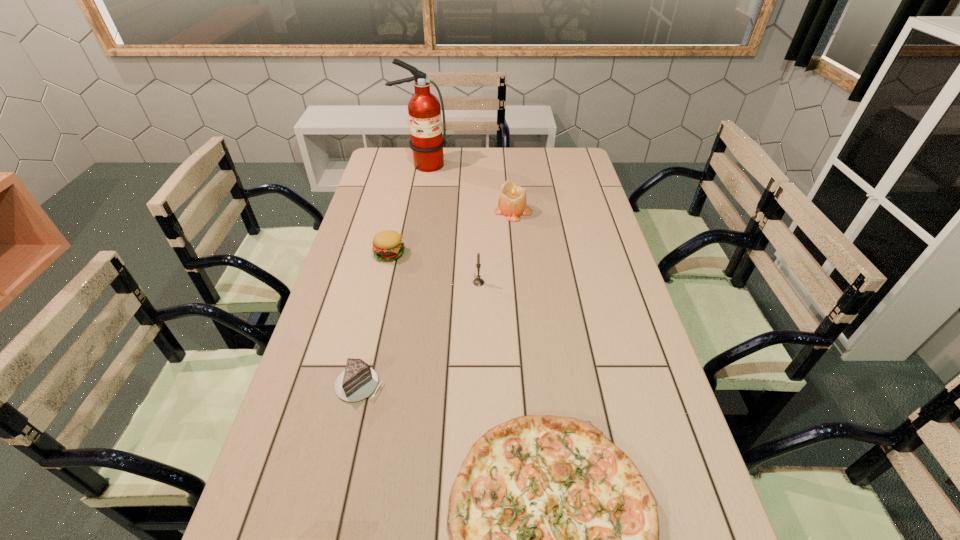
The width and height of the screenshot is (960, 540). Identify the location of vacant space situated on the right of the fifth nearest object. (593, 212).

Locate an element on the screen. This screenshot has width=960, height=540. blank area located 0.090m on the back of the third nearest object is located at coordinates coord(479,260).

Where is `vacant space situated 0.140m on the right of the third farthest object`? vacant space situated 0.140m on the right of the third farthest object is located at coordinates (446, 253).

Where is `vacant region located 0.170m on the back of the fifth farthest object`? vacant region located 0.170m on the back of the fifth farthest object is located at coordinates (375, 319).

I want to click on object at the far edge, so click(424, 110).

Locate an element on the screen. The width and height of the screenshot is (960, 540). fire extinguisher at the left edge is located at coordinates (424, 110).

Find the location of a particular element. hamburger present at the left edge is located at coordinates (388, 245).

Locate an element on the screen. This screenshot has width=960, height=540. chocolate cake that is at the left edge is located at coordinates (358, 381).

The height and width of the screenshot is (540, 960). Find the location of `object positioned at the far left corner`. object positioned at the far left corner is located at coordinates 424,110.

Where is `vacant region at the far edge of the desktop`? vacant region at the far edge of the desktop is located at coordinates (517, 159).